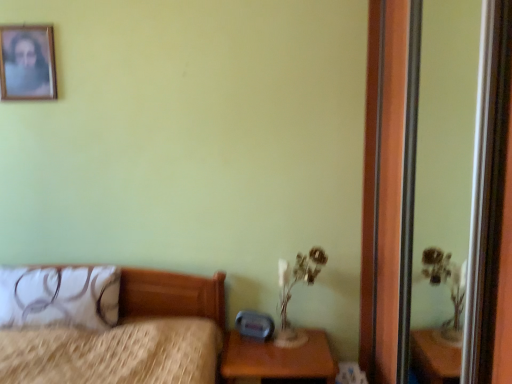
Image resolution: width=512 pixels, height=384 pixels. What do you see at coordinates (290, 293) in the screenshot? I see `translucent glass table lamp at lower right` at bounding box center [290, 293].

Image resolution: width=512 pixels, height=384 pixels. What do you see at coordinates (27, 63) in the screenshot?
I see `wooden picture frame at upper left` at bounding box center [27, 63].

The height and width of the screenshot is (384, 512). I want to click on transparent glass screen door at right, so click(x=389, y=183).

This screenshot has width=512, height=384. Find the location of `brown wooden nightstand at lower right`. brown wooden nightstand at lower right is located at coordinates (279, 360).

Is point (178, 374) in front of point (306, 271)?

That is True.

Which is correct: wooden bed at left is inside translucent glass table lamp at lower right, or outside of it?

wooden bed at left is not inside translucent glass table lamp at lower right, it's outside.

Can you confirm if wooden bed at left is positioned to the left of translucent glass table lamp at lower right?

Yes.

Is wooden bed at left shorter than translucent glass table lamp at lower right?

No, wooden bed at left is not shorter than translucent glass table lamp at lower right.

Which is in front, white fabric pillow at left or wooden picture frame at upper left?

white fabric pillow at left.

Measure the distance between white fabric pillow at left and wooden picture frame at upper left.

They are 3.47 feet apart.

Which is closer, [52,275] or [34,60]?

Point [52,275] appears to be closer to the viewer than point [34,60].

From the image's perspective, is white fabric pillow at left over wooden picture frame at upper left?

No.

Based on their sizes in the image, would you say translucent glass table lamp at lower right is bigger or smaller than white fabric pillow at left?

Clearly, translucent glass table lamp at lower right is smaller in size than white fabric pillow at left.

Which object is positioned more to the left, translucent glass table lamp at lower right or white fabric pillow at left?

white fabric pillow at left.

Which object is wider, translucent glass table lamp at lower right or white fabric pillow at left?

Wider between the two is white fabric pillow at left.

Where is `table lamp lying behind the white fabric pillow at left`? table lamp lying behind the white fabric pillow at left is located at coordinates (290, 293).

Considering the sizes of objects wooden bed at left and transparent glass screen door at right in the image provided, who is taller, wooden bed at left or transparent glass screen door at right?

transparent glass screen door at right.

Is wooden bed at left not near transparent glass screen door at right?

Yes, wooden bed at left is far from transparent glass screen door at right.

Is wooden bed at left wider or thinner than transparent glass screen door at right?

In the image, wooden bed at left appears to be wider than transparent glass screen door at right.

From the image's perspective, which is below, wooden bed at left or transparent glass screen door at right?

wooden bed at left is shown below in the image.

Can you tell me how much wooden picture frame at upper left and transparent glass screen door at right differ in facing direction?

The facing directions of wooden picture frame at upper left and transparent glass screen door at right are 90.2 degrees apart.

Is wooden picture frame at upper left taller or shorter than transparent glass screen door at right?

wooden picture frame at upper left is shorter than transparent glass screen door at right.

Looking at this image, is wooden picture frame at upper left inside or outside of transparent glass screen door at right?

wooden picture frame at upper left is not inside transparent glass screen door at right, it's outside.

Based on their sizes in the image, would you say transparent glass screen door at right is bigger or smaller than wooden bed at left?

Clearly, transparent glass screen door at right is smaller in size than wooden bed at left.

Is transparent glass screen door at right outside of wooden bed at left?

transparent glass screen door at right lies outside wooden bed at left's area.

This screenshot has height=384, width=512. Identify the location of screen door in front of the wooden bed at left. (389, 183).

Based on the photo, is transparent glass screen door at right directly adjacent to wooden bed at left?

They are not placed beside each other.

In the scene shown: Does transparent glass screen door at right lie in front of white fabric pillow at left?

Yes, transparent glass screen door at right is in front of white fabric pillow at left.

How different are the orientations of transparent glass screen door at right and white fabric pillow at left in degrees?

The angle between the facing direction of transparent glass screen door at right and the facing direction of white fabric pillow at left is 89.3 degrees.

Does transparent glass screen door at right have a larger size compared to white fabric pillow at left?

Correct, transparent glass screen door at right is larger in size than white fabric pillow at left.

Is transparent glass screen door at right positioned far away from white fabric pillow at left?

Yes, transparent glass screen door at right and white fabric pillow at left are quite far apart.

Locate an element on the screen. The width and height of the screenshot is (512, 384). table lamp above the wooden bed at left (from the image's perspective) is located at coordinates (290, 293).

You are a GUI agent. You are given a task and a screenshot of the screen. Output one action in this format:
    pyautogui.click(x=<x>, y=<y>)
    Task: Click on the pillow below the wooden picture frame at upper left (from a real-world perspective)
    This screenshot has width=512, height=384.
    Given the screenshot: What is the action you would take?
    pyautogui.click(x=60, y=296)

Based on their spatial positions, is transparent glass screen door at right or wooden picture frame at upper left further from wooden bed at left?

wooden picture frame at upper left is positioned further to the anchor wooden bed at left.

When comparing their distances from translucent glass table lamp at lower right, does white fabric pillow at left or brown wooden nightstand at lower right seem closer?

Based on the image, brown wooden nightstand at lower right appears to be nearer to translucent glass table lamp at lower right.

When comparing their distances from transparent glass screen door at right, does wooden bed at left or wooden picture frame at upper left seem further?

Among the two, wooden picture frame at upper left is located further to transparent glass screen door at right.

Based on their spatial positions, is white fabric pillow at left or transparent glass screen door at right further from wooden bed at left?

Among the two, transparent glass screen door at right is located further to wooden bed at left.

Looking at the image, which one is located closer to wooden bed at left, transparent glass screen door at right or white fabric pillow at left?

white fabric pillow at left lies closer to wooden bed at left than the other object.

Considering their positions, is brown wooden nightstand at lower right positioned further to white fabric pillow at left than wooden bed at left?

brown wooden nightstand at lower right.

Looking at the image, which one is located closer to brown wooden nightstand at lower right, wooden picture frame at upper left or white fabric pillow at left?

white fabric pillow at left is closer to brown wooden nightstand at lower right.

Based on their spatial positions, is transparent glass screen door at right or wooden bed at left further from translucent glass table lamp at lower right?

The object further to translucent glass table lamp at lower right is wooden bed at left.

This screenshot has height=384, width=512. I want to click on table lamp located between white fabric pillow at left and transparent glass screen door at right in the left-right direction, so click(x=290, y=293).

Where is `bed located between wooden picture frame at upper left and transparent glass screen door at right in the left-right direction`? This screenshot has height=384, width=512. bed located between wooden picture frame at upper left and transparent glass screen door at right in the left-right direction is located at coordinates (130, 337).

At what (x,y) coordinates should I click in order to perform the action: click on nightstand between wooden bed at left and translucent glass table lamp at lower right from left to right. Please return your answer as a coordinate pair (x, y). Looking at the image, I should click on (279, 360).

At what (x,y) coordinates should I click in order to perform the action: click on nightstand between wooden picture frame at upper left and transparent glass screen door at right. Please return your answer as a coordinate pair (x, y). The image size is (512, 384). Looking at the image, I should click on (279, 360).